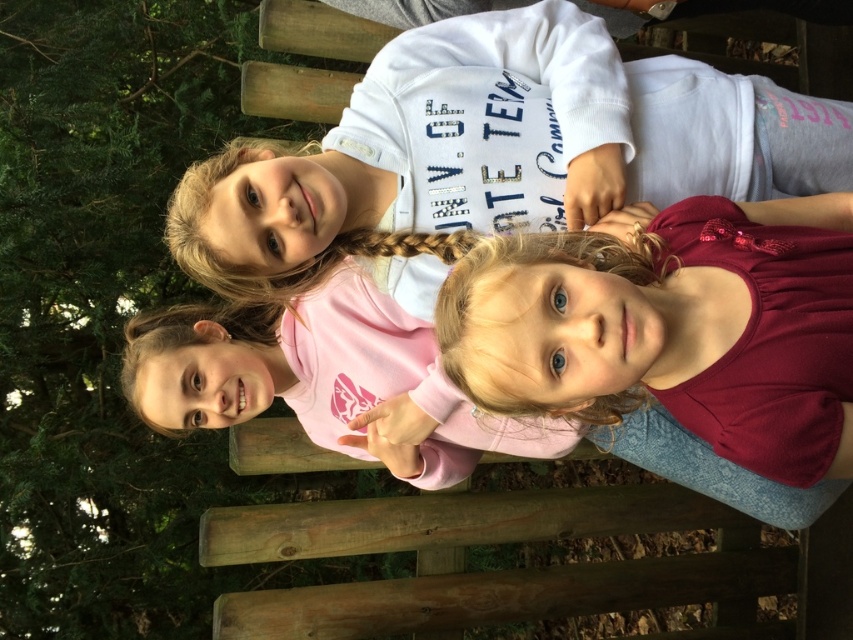
Question: Which point is closer to the camera?

Choices:
 (A) (172, 380)
 (B) (473, 61)

Answer: (B)

Question: In this image, where is white cotton shirt at upper center located relative to pink matte shirt at center?

Choices:
 (A) above
 (B) below

Answer: (A)

Question: Observing the image, what is the correct spatial positioning of white cotton shirt at upper center in reference to pink matte shirt at center?

Choices:
 (A) left
 (B) right

Answer: (B)

Question: Is white cotton shirt at upper center to the left of pink matte shirt at center from the viewer's perspective?

Choices:
 (A) no
 (B) yes

Answer: (A)

Question: Which point appears farthest from the camera in this image?

Choices:
 (A) [578, 426]
 (B) [425, 129]

Answer: (A)